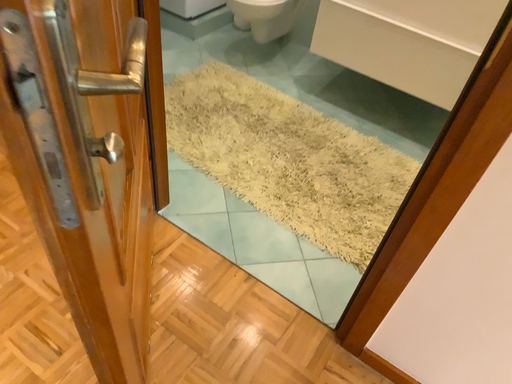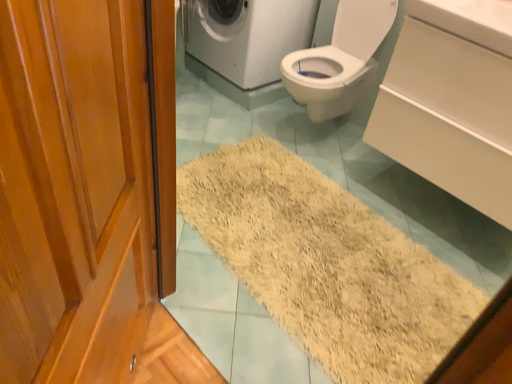
Question: How did the camera likely rotate when shooting the video?

Choices:
 (A) rotated left
 (B) rotated right

Answer: (A)